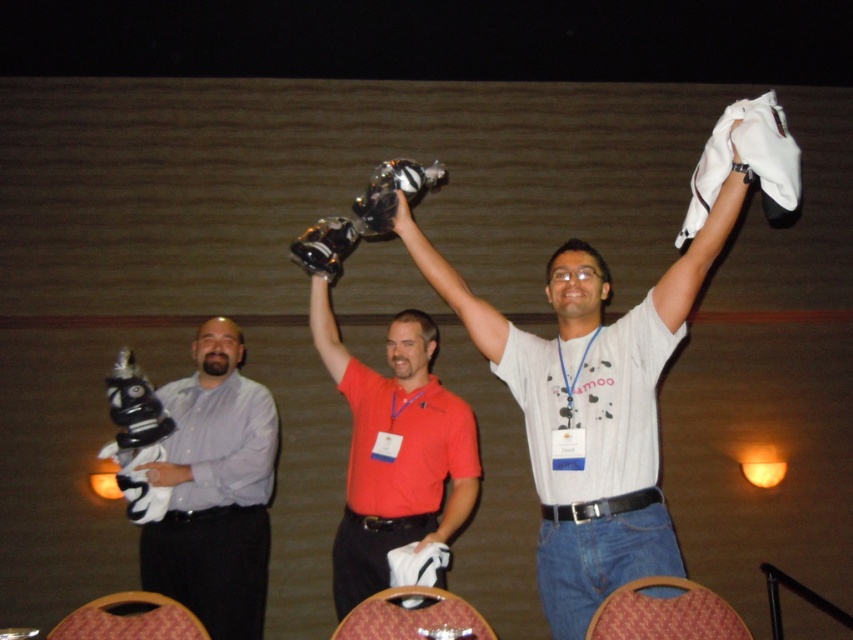
You are a photographer positioned at the wooden chair at lower left, and you want to take a photo of the red matte shirt at center. Can you comfortably adjust your camera settings without moving from your current position?

The distance between the red matte shirt at center and the wooden chair at lower left is 38.75 inches, so yes, you can comfortably adjust your camera settings without moving from the wooden chair at lower left since the distance allows enough space.